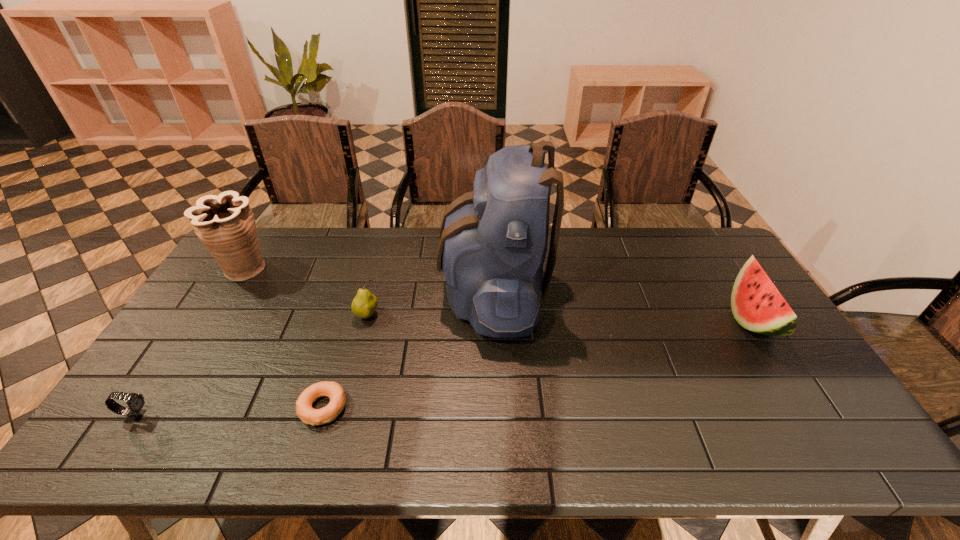
I want to click on vacant space at the right edge of the desktop, so click(x=706, y=282).

Locate an element on the screen. vacant area that lies between the third shortest object and the second object from right to left is located at coordinates (430, 303).

Locate an element on the screen. free space between the pear and the shortest object is located at coordinates (345, 362).

At what (x,y) coordinates should I click in order to perform the action: click on empty space that is in between the tallest object and the bagel. Please return your answer as a coordinate pair (x, y). The image size is (960, 540). Looking at the image, I should click on (408, 349).

Image resolution: width=960 pixels, height=540 pixels. I want to click on empty space between the watch and the tallest object, so click(x=315, y=353).

Find the location of a particular element. The image size is (960, 540). free space between the second tallest object and the second object from right to left is located at coordinates (369, 280).

At what (x,y) coordinates should I click in order to perform the action: click on free space between the fifth shortest object and the shortest object. Please return your answer as a coordinate pair (x, y). Looking at the image, I should click on click(x=283, y=339).

At what (x,y) coordinates should I click in order to perform the action: click on free point between the pear and the urn. Please return your answer as a coordinate pair (x, y). The image size is (960, 540). Looking at the image, I should click on (306, 293).

The height and width of the screenshot is (540, 960). I want to click on free spot between the tallest object and the watch, so click(315, 353).

This screenshot has height=540, width=960. I want to click on free area in between the watch and the pear, so click(252, 366).